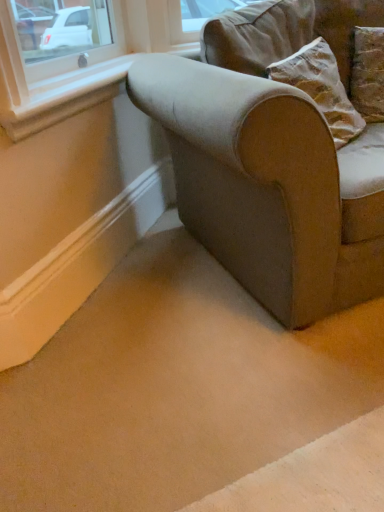
Question: Which is correct: velvet-like beige couch at center is inside white smooth window sill at upper left, or outside of it?

Choices:
 (A) inside
 (B) outside

Answer: (B)

Question: Is velvet-like beige couch at center to the left or to the right of white smooth window sill at upper left in the image?

Choices:
 (A) left
 (B) right

Answer: (B)

Question: Relative to white smooth window sill at upper left, is velvet-like beige couch at center in front or behind?

Choices:
 (A) front
 (B) behind

Answer: (A)

Question: Looking at their shapes, would you say white smooth window sill at upper left is wider or thinner than velvet-like beige couch at center?

Choices:
 (A) wide
 (B) thin

Answer: (B)

Question: From a real-world perspective, is white smooth window sill at upper left above or below velvet-like beige couch at center?

Choices:
 (A) below
 (B) above

Answer: (B)

Question: From the image's perspective, is white smooth window sill at upper left positioned above or below velvet-like beige couch at center?

Choices:
 (A) above
 (B) below

Answer: (A)

Question: Visually, is white smooth window sill at upper left positioned to the left or to the right of velvet-like beige couch at center?

Choices:
 (A) left
 (B) right

Answer: (A)